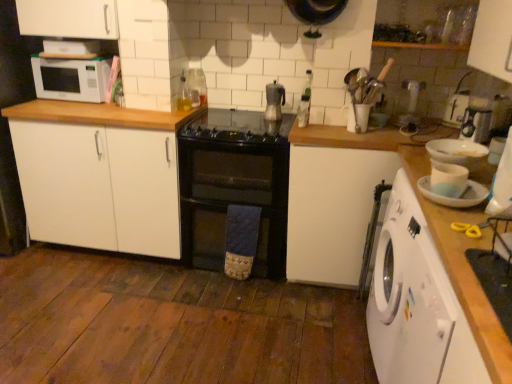
Question: Is black glass gas stove at center outside of white matte countertop at right?

Choices:
 (A) no
 (B) yes

Answer: (B)

Question: Can you confirm if black glass gas stove at center is smaller than white matte countertop at right?

Choices:
 (A) no
 (B) yes

Answer: (B)

Question: Considering the relative positions of black glass gas stove at center and white matte countertop at right in the image provided, is black glass gas stove at center to the right of white matte countertop at right from the viewer's perspective?

Choices:
 (A) no
 (B) yes

Answer: (A)

Question: From a real-world perspective, does black glass gas stove at center sit lower than white matte countertop at right?

Choices:
 (A) yes
 (B) no

Answer: (B)

Question: Is white matte countertop at right surrounded by black glass gas stove at center?

Choices:
 (A) yes
 (B) no

Answer: (B)

Question: Looking at their shapes, would you say white matte microwave at upper left is wider or thinner than black glass gas stove at center?

Choices:
 (A) wide
 (B) thin

Answer: (B)

Question: In the image, is white matte microwave at upper left on the left side or the right side of black glass gas stove at center?

Choices:
 (A) left
 (B) right

Answer: (A)

Question: Considering their positions, is white matte microwave at upper left located in front of or behind black glass gas stove at center?

Choices:
 (A) behind
 (B) front

Answer: (A)

Question: From their relative heights in the image, would you say white matte microwave at upper left is taller or shorter than black glass gas stove at center?

Choices:
 (A) tall
 (B) short

Answer: (A)

Question: From the image's perspective, is black glass oven at center positioned above or below white matte countertop at right?

Choices:
 (A) above
 (B) below

Answer: (A)

Question: Is point (184, 240) closer or farther from the camera than point (435, 130)?

Choices:
 (A) farther
 (B) closer

Answer: (A)

Question: Is black glass oven at center wider or thinner than white matte countertop at right?

Choices:
 (A) thin
 (B) wide

Answer: (B)

Question: Is black glass oven at center inside the boundaries of white matte countertop at right, or outside?

Choices:
 (A) outside
 (B) inside

Answer: (A)

Question: Is point (276, 112) positioned closer to the camera than point (206, 129)?

Choices:
 (A) closer
 (B) farther

Answer: (B)

Question: Is metallic silver coffee maker at center, positioned as the 1th appliance in left-to-right order, in front of or behind black glass gas stove at center in the image?

Choices:
 (A) behind
 (B) front

Answer: (A)